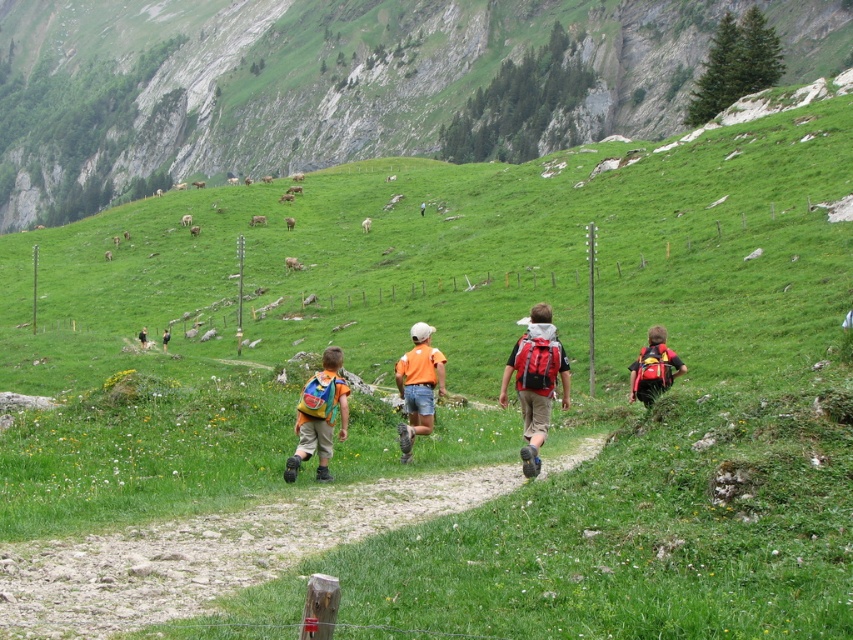
You are one of the hikers and you see the red backpack at right and the orange backpack at center. Which backpack is positioned further to the right?

The red backpack at right is positioned further to the right than the orange backpack at center.